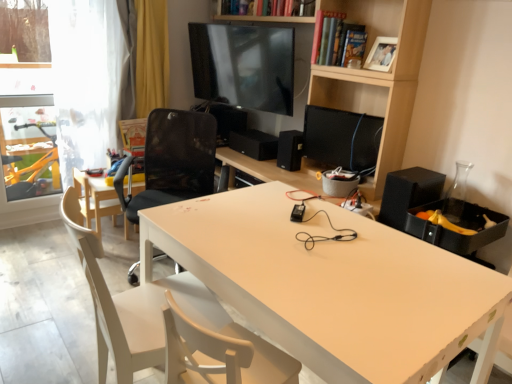
Where is `black matte computer monitor at center`? black matte computer monitor at center is located at coordinates (342, 138).

The image size is (512, 384). Describe the element at coordinates (135, 306) in the screenshot. I see `white wood chair at lower left, marked as the third chair in a back-to-front arrangement` at that location.

At what (x,y) coordinates should I click in order to perform the action: click on black mesh chair at center, which is the second chair in back-to-front order. Please return your answer as a coordinate pair (x, y). Looking at the image, I should click on (172, 161).

The width and height of the screenshot is (512, 384). What do you see at coordinates (172, 161) in the screenshot? I see `black mesh chair at center, which is the second chair in front-to-back order` at bounding box center [172, 161].

Find the location of a particular element. The image size is (512, 384). black matte computer monitor at center is located at coordinates (342, 138).

From the image's perspective, would you say black matte speaker at right, placed as the first speaker when sorted from right to left, is positioned over matte black tv at upper center?

No, from the image's perspective, black matte speaker at right, placed as the first speaker when sorted from right to left, is not above matte black tv at upper center.

Is black matte speaker at right, positioned as the first speaker in front-to-back order, far away from matte black tv at upper center?

black matte speaker at right, positioned as the first speaker in front-to-back order, is far away from matte black tv at upper center.

Is point (386, 202) closer to camera compared to point (241, 105)?

Yes, it is.

Considering the sizes of objects black matte speaker at right, positioned as the 3th speaker in left-to-right order, and matte black tv at upper center in the image provided, who is wider, black matte speaker at right, positioned as the 3th speaker in left-to-right order, or matte black tv at upper center?

With larger width is black matte speaker at right, positioned as the 3th speaker in left-to-right order.

Which of these two, matte black tv at upper center or black matte computer monitor at center, is smaller?

black matte computer monitor at center is smaller.

Can you confirm if matte black tv at upper center is wider than black matte computer monitor at center?

In fact, matte black tv at upper center might be narrower than black matte computer monitor at center.

From a real-world perspective, does matte black tv at upper center stand above black matte computer monitor at center?

Yes, from a real-world perspective, matte black tv at upper center is over black matte computer monitor at center

How many degrees apart are the facing directions of matte black tv at upper center and transparent glass door at left?

75.8 degrees separate the facing orientations of matte black tv at upper center and transparent glass door at left.

Does matte black tv at upper center have a lesser width compared to transparent glass door at left?

Incorrect, the width of matte black tv at upper center is not less than that of transparent glass door at left.

In the image, is matte black tv at upper center on the left side or the right side of transparent glass door at left?

Based on their positions, matte black tv at upper center is located to the right of transparent glass door at left.

Looking at this image, could you measure the distance between white matte desk at center and black mesh chair at center, which is the second chair in back-to-front order?

The distance of white matte desk at center from black mesh chair at center, which is the second chair in back-to-front order, is 3.88 feet.

Is white matte desk at center wider or thinner than black mesh chair at center, which is the second chair in front-to-back order?

In the image, white matte desk at center appears to be wider than black mesh chair at center, which is the second chair in front-to-back order.

In the scene shown: Considering the relative sizes of white matte desk at center and black mesh chair at center, which is the second chair in front-to-back order, in the image provided, is white matte desk at center bigger than black mesh chair at center, which is the second chair in front-to-back order,?

Yes.

Does white matte desk at center appear on the left side of black mesh chair at center, which is the second chair in back-to-front order?

No.

Can you confirm if transparent glass door at left is bigger than black matte speaker at center, the 2th speaker viewed from the left?

Indeed, transparent glass door at left has a larger size compared to black matte speaker at center, the 2th speaker viewed from the left.

Considering the positions of objects transparent glass door at left and black matte speaker at center, marked as the second speaker in a front-to-back arrangement, in the image provided, who is in front, transparent glass door at left or black matte speaker at center, marked as the second speaker in a front-to-back arrangement,?

transparent glass door at left is more forward.

Do you think transparent glass door at left is within black matte speaker at center, which is the 2th speaker in right-to-left order, or outside of it?

transparent glass door at left lies outside black matte speaker at center, which is the 2th speaker in right-to-left order.

Considering the positions of points (101, 101) and (279, 163), is point (101, 101) farther from camera compared to point (279, 163)?

Yes, point (101, 101) is farther from viewer.

Considering the relative sizes of black matte speaker at center, which is the 2th speaker in right-to-left order, and black matte speaker at right, positioned as the 3th speaker in left-to-right order, in the image provided, is black matte speaker at center, which is the 2th speaker in right-to-left order, wider than black matte speaker at right, positioned as the 3th speaker in left-to-right order,?

No.

Is black matte speaker at center, the 2th speaker viewed from the left, placed right next to black matte speaker at right, positioned as the 3th speaker in left-to-right order?

black matte speaker at center, the 2th speaker viewed from the left, and black matte speaker at right, positioned as the 3th speaker in left-to-right order, are clearly separated.

Who is shorter, black matte speaker at center, which is the 2th speaker in right-to-left order, or black matte speaker at right, placed as the first speaker when sorted from right to left?

black matte speaker at center, which is the 2th speaker in right-to-left order.

From the image's perspective, which one is positioned higher, hardcover book at upper center, placed as the first book when sorted from left to right, or black mesh chair at center, which is the second chair in back-to-front order?

hardcover book at upper center, placed as the first book when sorted from left to right, from the image's perspective.

From the hardcover book at upper center, placed as the first book when sorted from left to right, count the 2nd chair to the left and point to it. Please provide its 2D coordinates.

[(172, 161)]

The image size is (512, 384). I want to click on television above the black matte speaker at right, positioned as the first speaker in front-to-back order (from the image's perspective), so click(x=244, y=65).

Image resolution: width=512 pixels, height=384 pixels. Find the location of `computer monitor below the matte black tv at upper center (from the image's perspective)`. computer monitor below the matte black tv at upper center (from the image's perspective) is located at coordinates (342, 138).

Looking at the image, which one is located closer to hardcover book at upper center, placed as the first book when sorted from left to right, black matte speaker at center, marked as the first speaker in a left-to-right arrangement, or black matte speaker at center, marked as the second speaker in a back-to-front arrangement?

black matte speaker at center, marked as the second speaker in a back-to-front arrangement.

Based on the photo, considering their positions, is white matte desk at center positioned closer to black matte speaker at center, which is counted as the first speaker, starting from the back, than hardcover book at upper center, the first book positioned from the right?

hardcover book at upper center, the first book positioned from the right, is positioned closer to the anchor black matte speaker at center, which is counted as the first speaker, starting from the back.

When comparing their distances from black matte speaker at center, marked as the second speaker in a front-to-back arrangement, does white matte desk at center or black matte speaker at right, positioned as the 3th speaker in left-to-right order, seem further?

white matte desk at center lies further to black matte speaker at center, marked as the second speaker in a front-to-back arrangement, than the other object.

Considering their positions, is matte black tv at upper center positioned further to light wood chair at left, which ranks as the 1th chair in back-to-front order, than hardcover book at upper center, the second book viewed from the left?

The object further to light wood chair at left, which ranks as the 1th chair in back-to-front order, is hardcover book at upper center, the second book viewed from the left.

From the image, which object appears to be farther from hardcover book at upper center, the second book viewed from the left, black mesh chair at center, which is the second chair in back-to-front order, or transparent glass door at left?

transparent glass door at left lies further to hardcover book at upper center, the second book viewed from the left, than the other object.

From the image, which object appears to be farther from hardcover book at upper center, the second book viewed from the left, hardcover book at upper center, placed as the first book when sorted from left to right, or matte black tv at upper center?

matte black tv at upper center.

Considering their positions, is transparent glass door at left positioned further to white matte desk at center than black matte speaker at right, positioned as the first speaker in front-to-back order?

Among the two, transparent glass door at left is located further to white matte desk at center.

Estimate the real-world distances between objects in this image. Which object is further from black matte speaker at right, the third speaker when ordered from back to front, white matte desk at center or black matte speaker at center, which is counted as the 3th speaker, starting from the front?

black matte speaker at center, which is counted as the 3th speaker, starting from the front.

Where is `book between transparent glass door at left and black matte computer monitor at center`? Image resolution: width=512 pixels, height=384 pixels. book between transparent glass door at left and black matte computer monitor at center is located at coordinates click(328, 38).

Identify the location of computer monitor between white matte desk at center and black matte speaker at center, which is counted as the 3th speaker, starting from the front, in the front-back direction. This screenshot has height=384, width=512. (342, 138).

Locate an element on the screen. Image resolution: width=512 pixels, height=384 pixels. desk between transparent glass door at left and black matte speaker at right, the third speaker when ordered from back to front, in the horizontal direction is located at coordinates (333, 285).

Locate an element on the screen. Image resolution: width=512 pixels, height=384 pixels. book between transparent glass door at left and hardcover book at upper center, the second book viewed from the left is located at coordinates (328, 38).